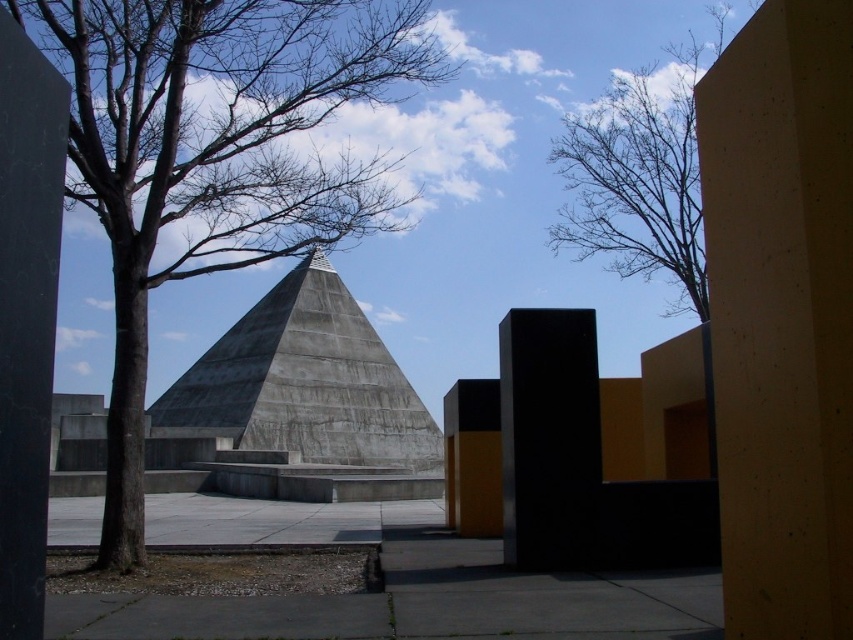
Question: Which point is closer to the camera?

Choices:
 (A) (775, 22)
 (B) (532, 404)
 (C) (488, 388)
 (D) (289, 307)

Answer: (A)

Question: Which point is closer to the camera?

Choices:
 (A) yellow matte pillar at center
 (B) black matte pillar at center

Answer: (B)

Question: Among these objects, which one is nearest to the camera?

Choices:
 (A) bare branches at upper right
 (B) black matte pillar at center
 (C) smooth concrete pillar at center right
 (D) yellow matte pillar at center

Answer: (C)

Question: Is smooth concrete pillar at center right positioned behind yellow matte pillar at center?

Choices:
 (A) yes
 (B) no

Answer: (B)

Question: Observing the image, what is the correct spatial positioning of bare branches at upper right in reference to black matte pillar at center?

Choices:
 (A) right
 (B) left

Answer: (A)

Question: Can you confirm if brown leafless tree at left is thinner than bare branches at upper right?

Choices:
 (A) no
 (B) yes

Answer: (B)